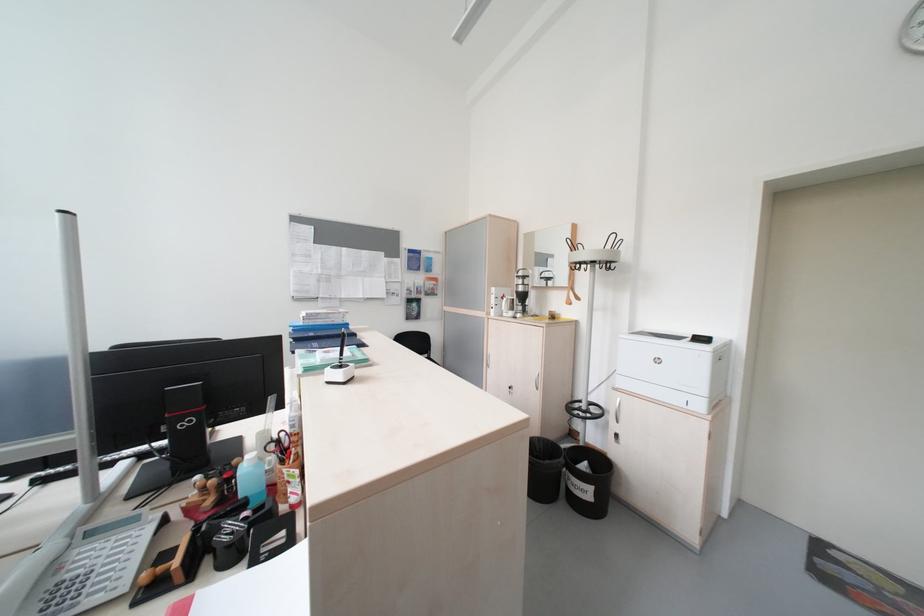
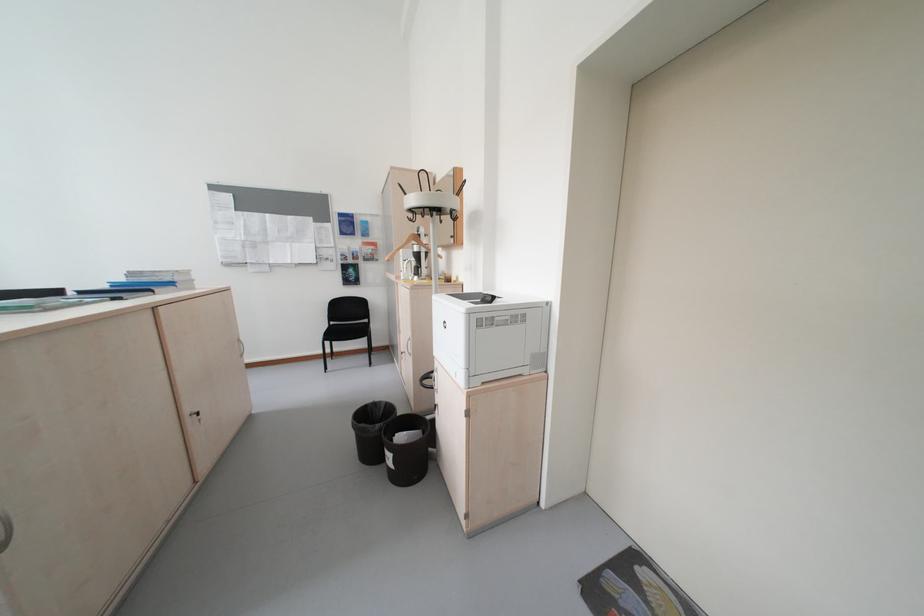
In the second image, find the point that corresponds to [450,292] in the first image.

(393, 257)